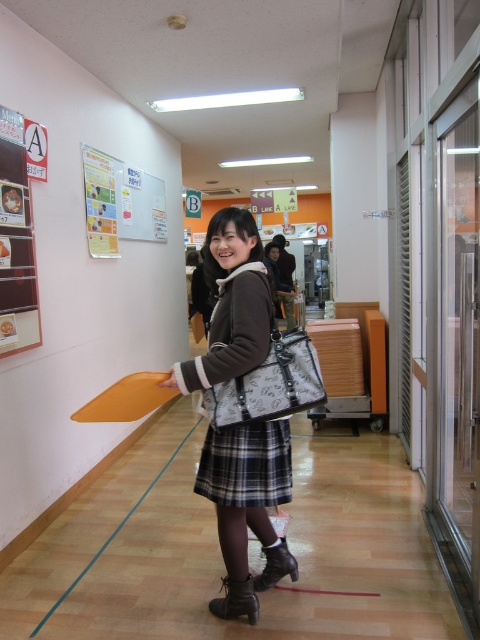
You are a GUI agent. You are given a task and a screenshot of the screen. Output one action in this format:
    pyautogui.click(x=<x>, y=<y>)
    Task: Click on the plaid skirt at center
    The image size is (480, 640).
    Given the screenshot: What is the action you would take?
    pyautogui.click(x=230, y=305)

Looking at this image, who is positioned more to the left, plaid skirt at center or plaid fabric skirt at center?

plaid skirt at center is more to the left.

Where is `plaid skirt at center`? The image size is (480, 640). plaid skirt at center is located at coordinates [x=230, y=305].

Does plaid fabric skirt at center appear under leather boot at lower center?

No, plaid fabric skirt at center is not below leather boot at lower center.

Which is above, plaid fabric skirt at center or leather boot at lower center?

plaid fabric skirt at center is higher up.

Is point (206, 444) behind point (229, 611)?

No, it is in front of (229, 611).

Find the location of a particular element. The height and width of the screenshot is (640, 480). plaid fabric skirt at center is located at coordinates (245, 465).

Between plaid fabric dress at center and plaid fabric skirt at center, which one is positioned higher?

plaid fabric dress at center

Is point (216, 477) farther from viewer compared to point (257, 492)?

Yes.

The image size is (480, 640). I want to click on plaid fabric dress at center, so click(245, 465).

The height and width of the screenshot is (640, 480). What are the coordinates of `plaid fabric dress at center` in the screenshot? It's located at (245, 465).